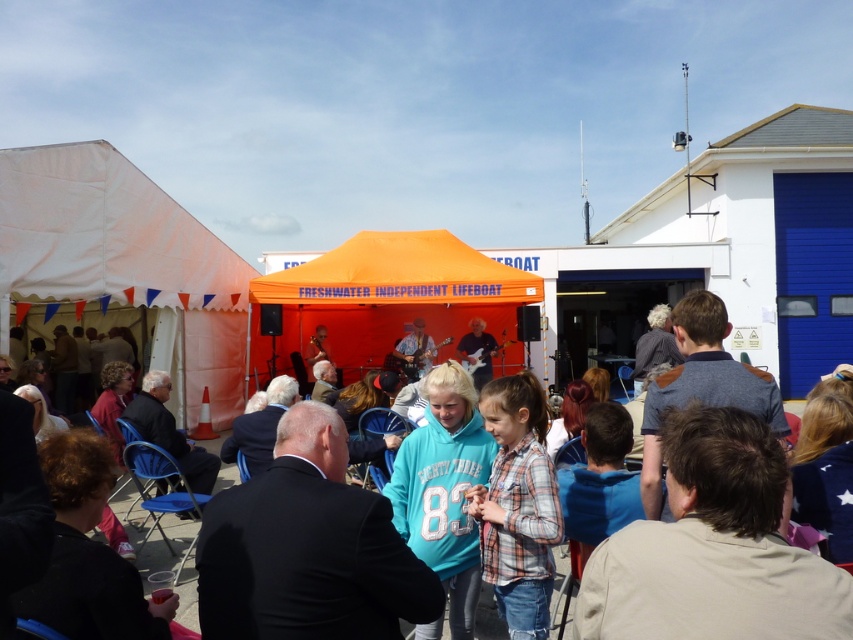
Does white canvas tent at left have a lesser width compared to orange fabric tent at center?

Yes.

Where is `white canvas tent at left`? white canvas tent at left is located at coordinates (126, 262).

What do you see at coordinates (126, 262) in the screenshot?
I see `white canvas tent at left` at bounding box center [126, 262].

In order to click on white canvas tent at left in this screenshot , I will do `click(126, 262)`.